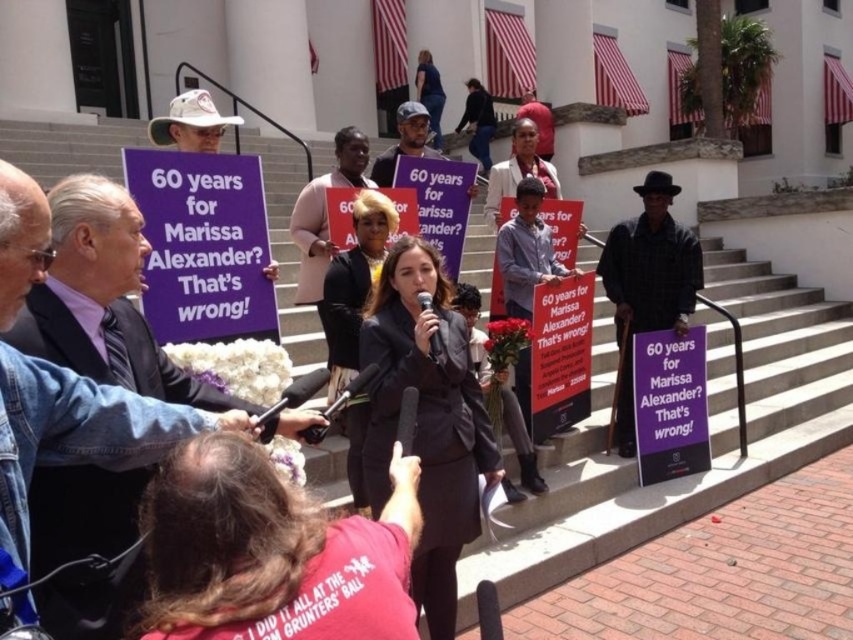
You are a photographer trying to capture a clear photo of the dark suit at center and the black hat at center. You have a camera that can only focus on objects wider than 15 cm. Can both objects be in focus?

The dark suit at center is wider than the black hat at center. Since the dark suit at center is wider than 15 cm, it will be in focus. However, the black hat at center might be narrower than 15 cm and thus may not be in focus. The photographer should check the exact width of the black hat at center to confirm.

You are a photographer standing at point [103,300]. You see the dark suit at center. What is the nearest object to you?

The nearest object to you is the dark suit at center located at point [103,300].